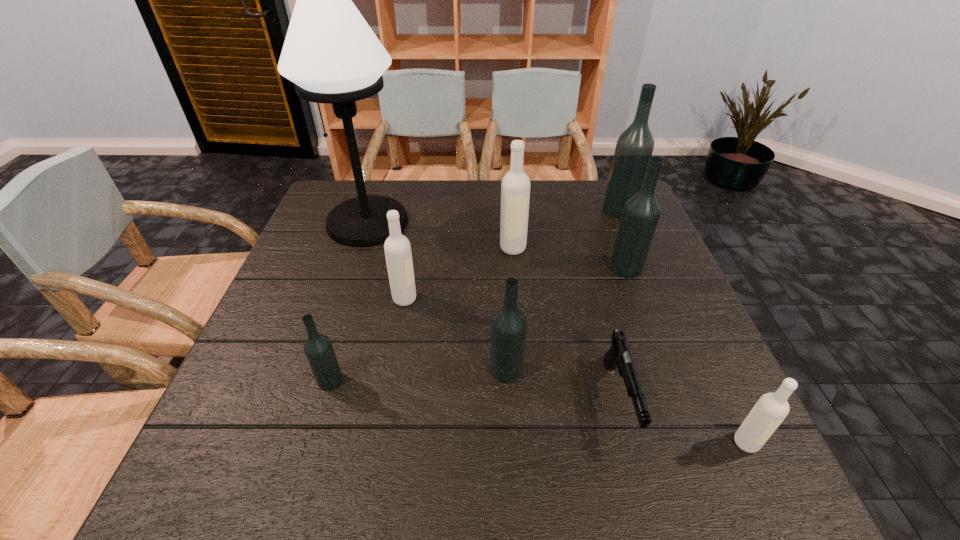
This screenshot has height=540, width=960. Find the location of `free spot between the second white vodka from left to right and the gun`. free spot between the second white vodka from left to right and the gun is located at coordinates (565, 323).

Where is `empty location between the gun and the leftmost black vodka`? empty location between the gun and the leftmost black vodka is located at coordinates point(474,390).

Identify the location of blank region between the nearest white vodka and the second biggest black vodka. The width and height of the screenshot is (960, 540). (685, 355).

Identify the location of blank region between the smallest white vodka and the second tallest object. The image size is (960, 540). (683, 326).

At what (x,y) coordinates should I click in order to perform the action: click on free point between the smallest black vodka and the table lamp. Please return your answer as a coordinate pair (x, y). The image size is (960, 540). Looking at the image, I should click on (348, 301).

I want to click on vacant region between the second farthest vodka and the fifth farthest object, so click(459, 273).

At what (x,y) coordinates should I click in order to perform the action: click on object that stands as the fifth closest to the smallest black vodka. Please return your answer as a coordinate pair (x, y). The width and height of the screenshot is (960, 540). Looking at the image, I should click on (618, 355).

I want to click on object identified as the second closest to the second black vodka from left to right, so click(x=397, y=248).

The height and width of the screenshot is (540, 960). Identify the location of vodka that is the sixth closest to the fifth nearest object. (771, 409).

Locate which vodka ranks fifth in proximity to the farthest white vodka. Please provide its 2D coordinates. Your answer should be formatted as a tuple, i.e. [(x, y)], where the tuple contains the x and y coordinates of a point satisfying the conditions above.

[(318, 348)]